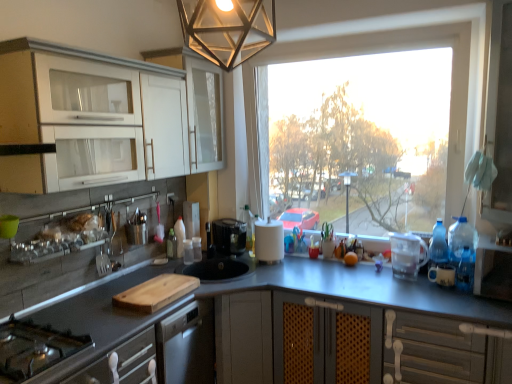
You are a GUI agent. You are given a task and a screenshot of the screen. Output one action in this format:
    pyautogui.click(x=<x>, y=<y>)
    Task: Click on the vacant area that is situated to the right of white matte paper towel at center
    
    Given the screenshot: What is the action you would take?
    pyautogui.click(x=300, y=265)